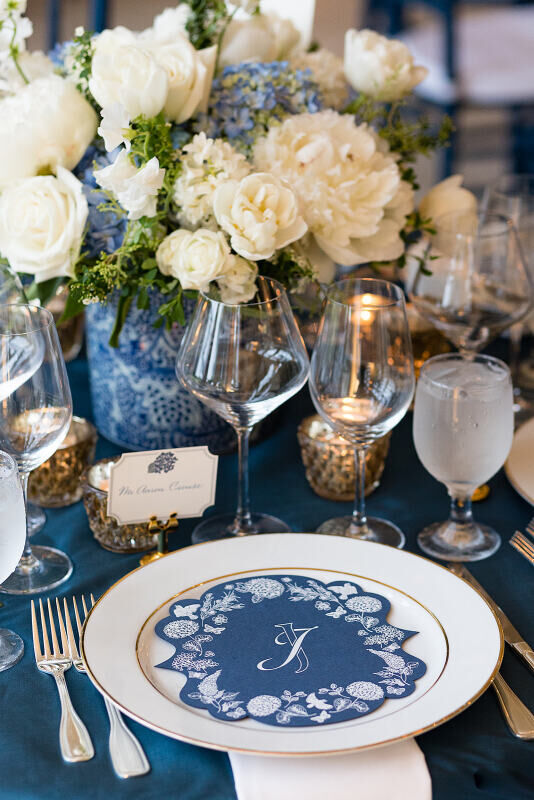
What are the coordinates of `placecard holder` in the screenshot? It's located at (164, 530).